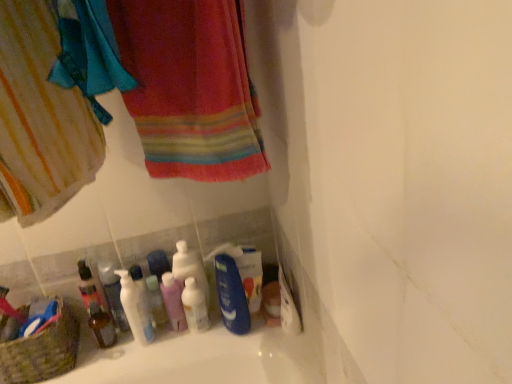
Question: Considering the relative sizes of textured wicker basket at lower left and white glossy pump bottle at lower left, marked as the 1th cleaning product in a left-to-right arrangement, in the image provided, is textured wicker basket at lower left shorter than white glossy pump bottle at lower left, marked as the 1th cleaning product in a left-to-right arrangement,?

Choices:
 (A) yes
 (B) no

Answer: (A)

Question: From the image's perspective, does textured wicker basket at lower left appear higher than white glossy pump bottle at lower left, positioned as the 3th cleaning product in right-to-left order?

Choices:
 (A) no
 (B) yes

Answer: (A)

Question: Does textured wicker basket at lower left have a greater height compared to white glossy pump bottle at lower left, positioned as the 3th cleaning product in right-to-left order?

Choices:
 (A) yes
 (B) no

Answer: (B)

Question: Could you tell me if textured wicker basket at lower left is turned towards white glossy pump bottle at lower left, positioned as the 3th cleaning product in right-to-left order?

Choices:
 (A) yes
 (B) no

Answer: (B)

Question: From a real-world perspective, is textured wicker basket at lower left below white glossy pump bottle at lower left, positioned as the 3th cleaning product in right-to-left order?

Choices:
 (A) no
 (B) yes

Answer: (B)

Question: From the image's perspective, is blue matte bottle at center, the first cleaning product viewed from the right, located above or below textured wicker basket at lower left?

Choices:
 (A) below
 (B) above

Answer: (B)

Question: Relative to textured wicker basket at lower left, is blue matte bottle at center, the third cleaning product when ordered from left to right, in front or behind?

Choices:
 (A) front
 (B) behind

Answer: (B)

Question: Looking at the image, does blue matte bottle at center, the first cleaning product viewed from the right, seem bigger or smaller compared to textured wicker basket at lower left?

Choices:
 (A) small
 (B) big

Answer: (A)

Question: Choose the correct answer: Is blue matte bottle at center, the first cleaning product viewed from the right, inside textured wicker basket at lower left or outside it?

Choices:
 (A) inside
 (B) outside

Answer: (B)

Question: Considering the positions of textured wicker basket at lower left and pink plastic mouthwash at center, the 3th mouthwash from the left, in the image, is textured wicker basket at lower left bigger or smaller than pink plastic mouthwash at center, the 3th mouthwash from the left,?

Choices:
 (A) big
 (B) small

Answer: (A)

Question: Is point (72, 337) positioned closer to the camera than point (169, 278)?

Choices:
 (A) farther
 (B) closer

Answer: (B)

Question: Considering the positions of textured wicker basket at lower left and pink plastic mouthwash at center, the 3th mouthwash from the left, in the image, is textured wicker basket at lower left taller or shorter than pink plastic mouthwash at center, the 3th mouthwash from the left,?

Choices:
 (A) tall
 (B) short

Answer: (B)

Question: In the image, is textured wicker basket at lower left positioned in front of or behind pink plastic mouthwash at center, the 3th mouthwash from the left?

Choices:
 (A) behind
 (B) front

Answer: (B)

Question: From the image's perspective, is textured wicker basket at lower left positioned above or below white glossy pump bottle at lower left, marked as the 1th cleaning product in a left-to-right arrangement?

Choices:
 (A) below
 (B) above

Answer: (A)

Question: Relative to white glossy pump bottle at lower left, marked as the 1th cleaning product in a left-to-right arrangement, is textured wicker basket at lower left in front or behind?

Choices:
 (A) front
 (B) behind

Answer: (A)